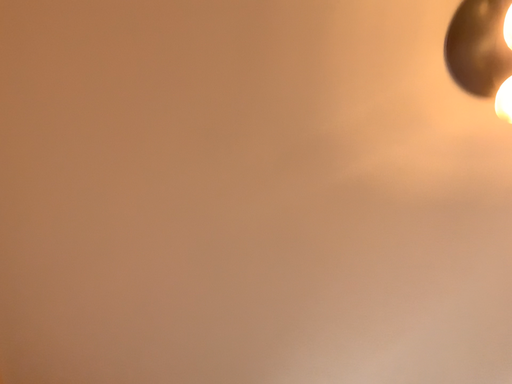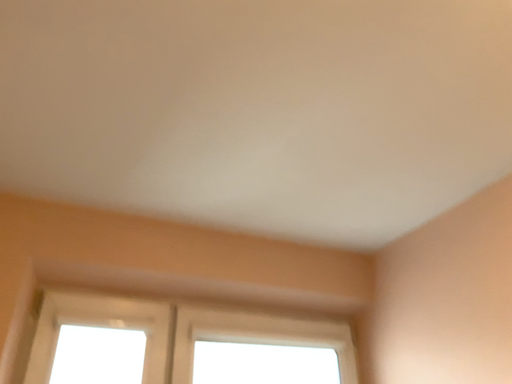
Question: Which way did the camera rotate in the video?

Choices:
 (A) rotated upward
 (B) rotated downward

Answer: (B)